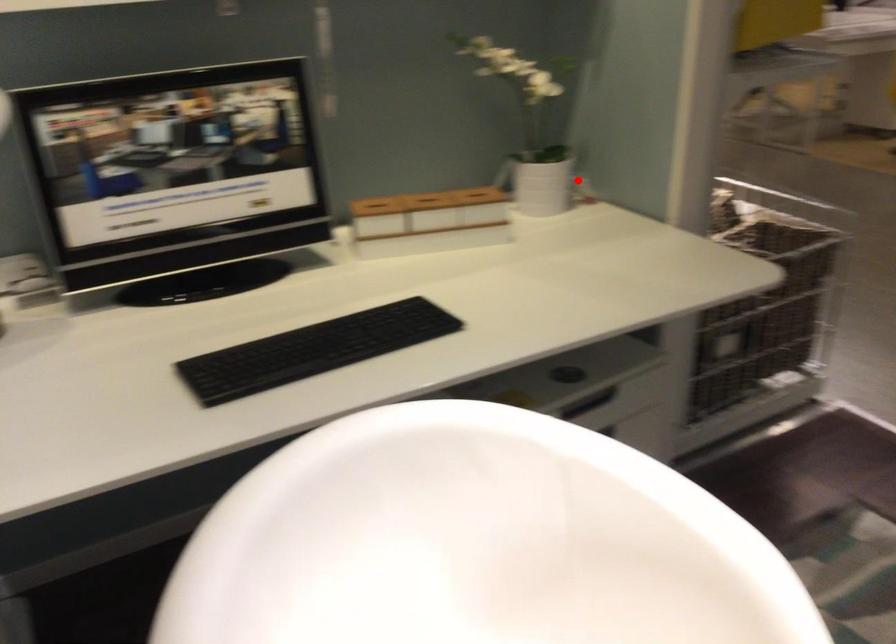
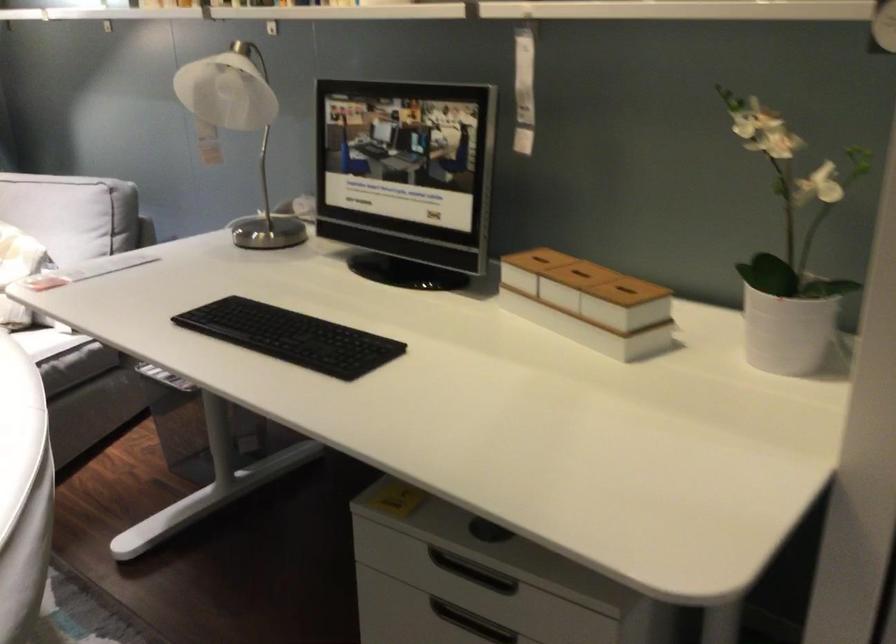
Question: I am providing you with two images of the same scene from different viewpoints. A red point is shown in image1. For the corresponding object point in image2, is it positioned nearer or farther from the camera?

Choices:
 (A) Nearer
 (B) Farther

Answer: (A)